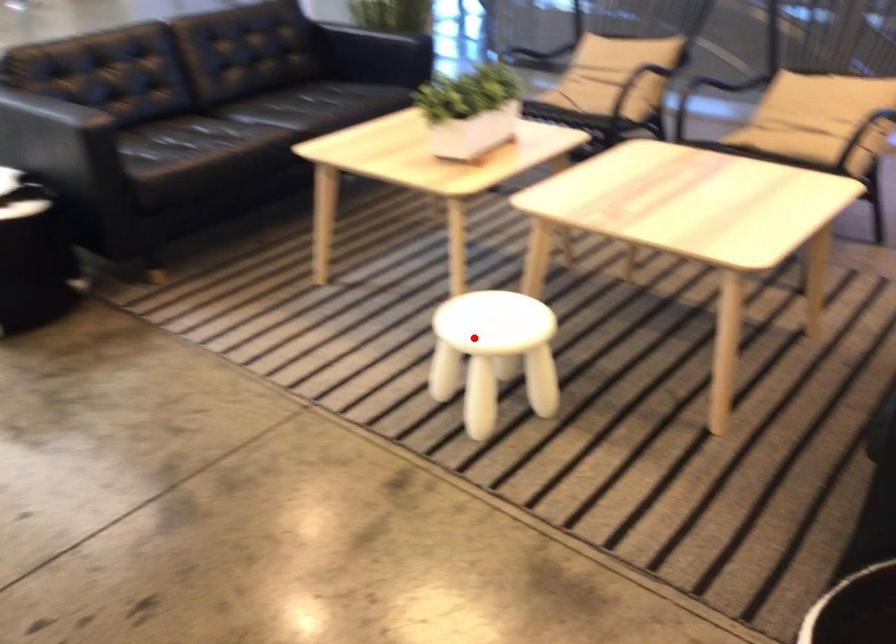
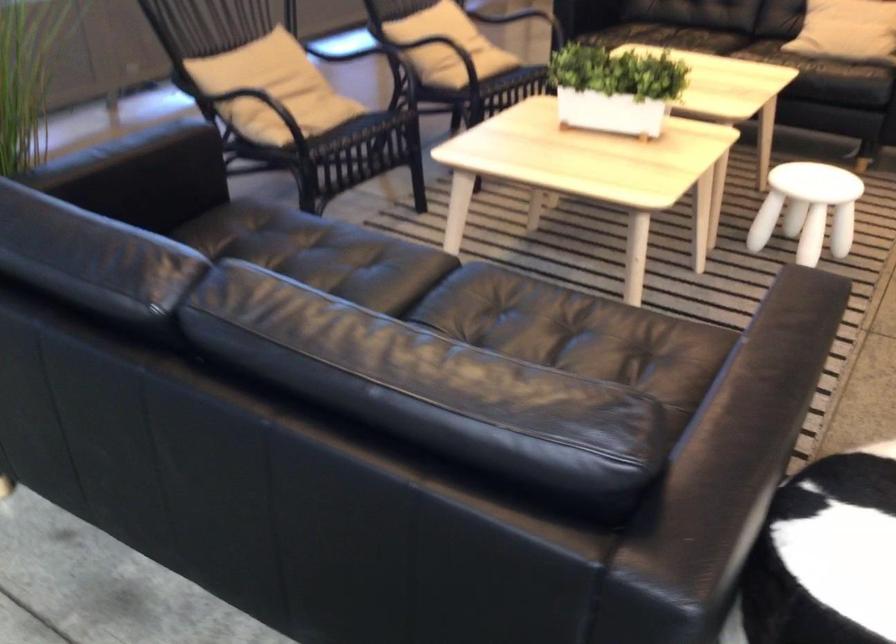
Find the pixel in the second image that matches the highlighted location in the first image.

(807, 209)